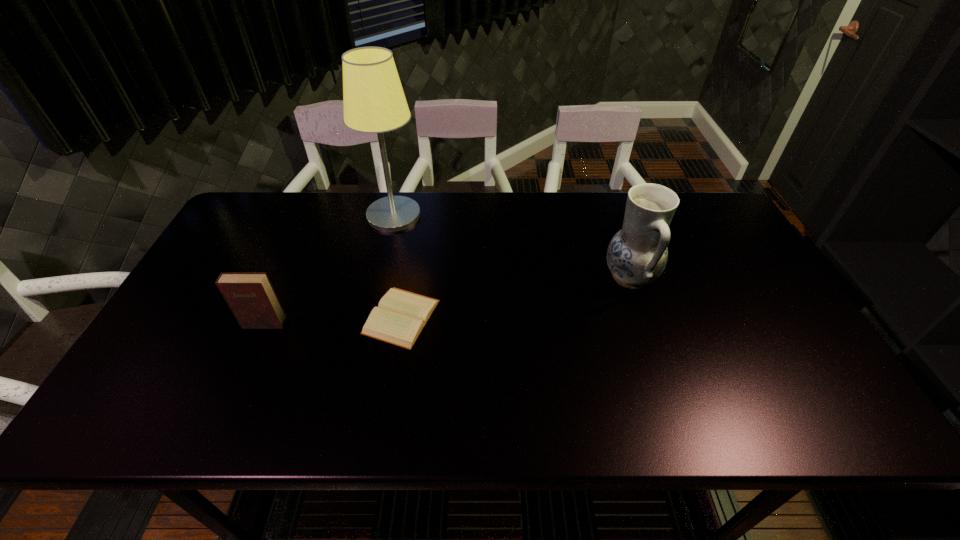
Find the location of a particular element. This screenshot has width=960, height=540. the farthest object is located at coordinates (374, 102).

Locate an element on the screen. The image size is (960, 540). the tallest object is located at coordinates (374, 102).

Identify the location of pottery. (637, 255).

Image resolution: width=960 pixels, height=540 pixels. I want to click on the rightmost object, so click(637, 255).

Where is `the taller diary`? The height and width of the screenshot is (540, 960). the taller diary is located at coordinates (251, 297).

Image resolution: width=960 pixels, height=540 pixels. Identify the location of the third tallest object. (251, 297).

At what (x,y) coordinates should I click in order to perform the action: click on the shorter diary. Please return your answer as a coordinate pair (x, y). The image size is (960, 540). Looking at the image, I should click on (401, 315).

This screenshot has width=960, height=540. Find the location of `the right diary`. the right diary is located at coordinates (401, 315).

The image size is (960, 540). In order to click on free space located 0.310m on the left of the farthest object in this screenshot , I will do `click(271, 215)`.

This screenshot has width=960, height=540. I want to click on vacant region located on the right of the pottery, so click(x=708, y=277).